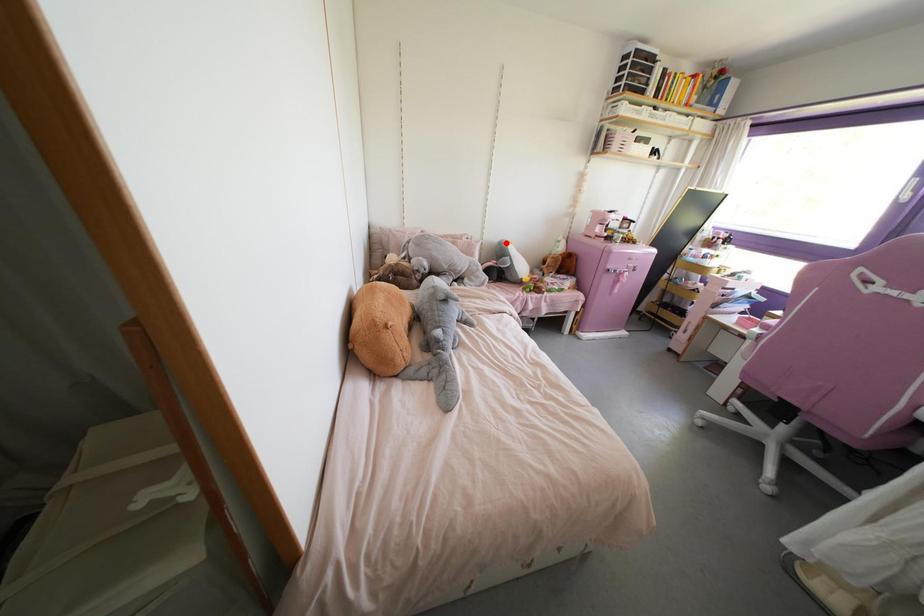
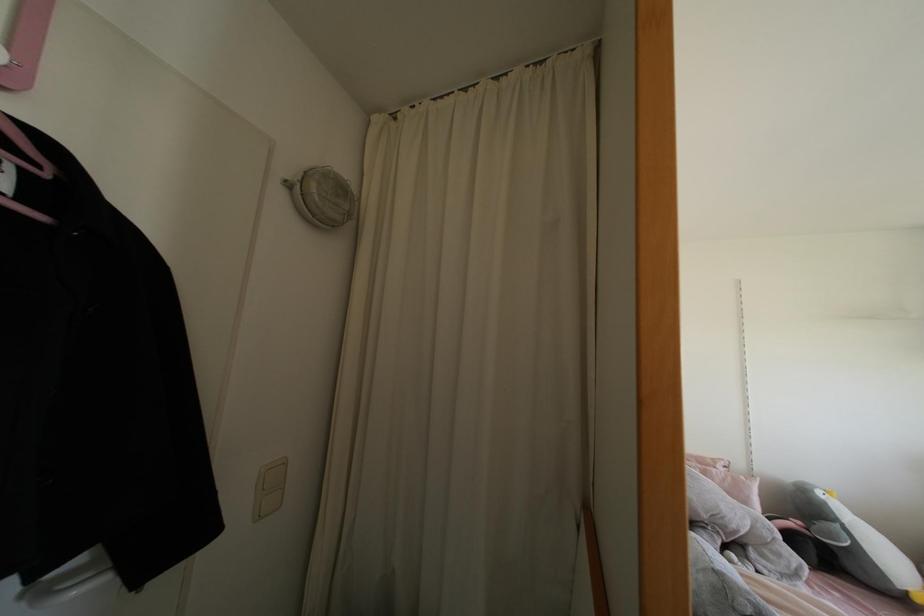
The point at the highlighted location is marked in the first image. Where is the corresponding point in the second image?

(819, 493)